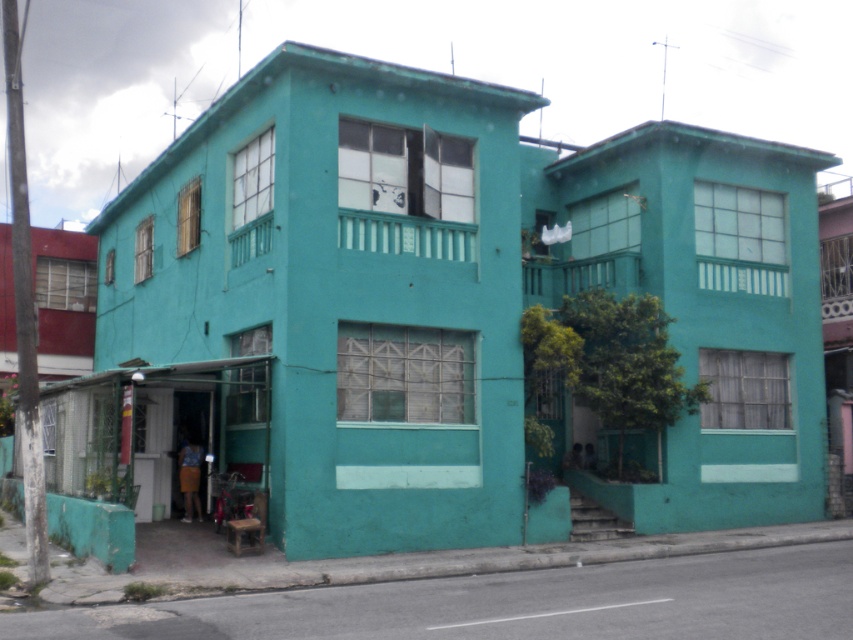
Can you confirm if teal matte building at center is positioned to the right of matte teal building at upper right?

No, teal matte building at center is not to the right of matte teal building at upper right.

Does point (135, 326) come in front of point (788, 266)?

No, it is behind (788, 266).

Which is in front, point (282, 525) or point (733, 348)?

Point (282, 525)

Where is `teal matte building at center`? teal matte building at center is located at coordinates (341, 296).